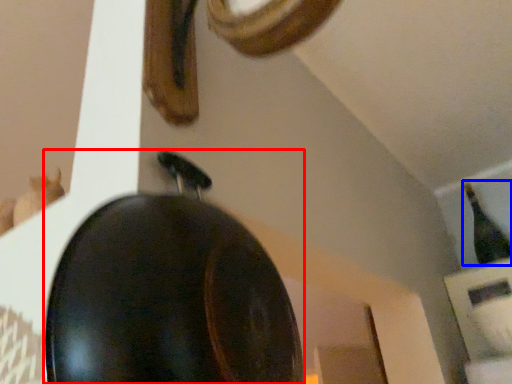
Question: Which point is further to the camera, frying pan (highlighted by a red box) or bottle (highlighted by a blue box)?

Choices:
 (A) frying pan
 (B) bottle

Answer: (B)